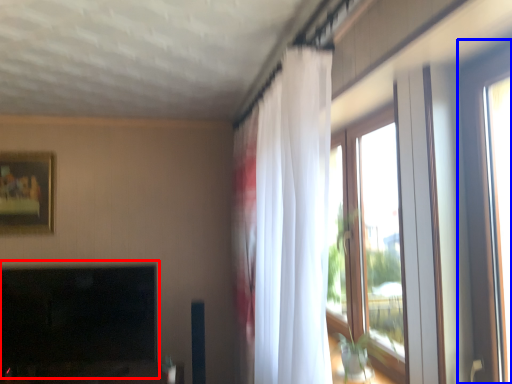
Question: Which object is closer to the camera taking this photo, fireplace (highlighted by a red box) or window (highlighted by a blue box)?

Choices:
 (A) fireplace
 (B) window

Answer: (B)